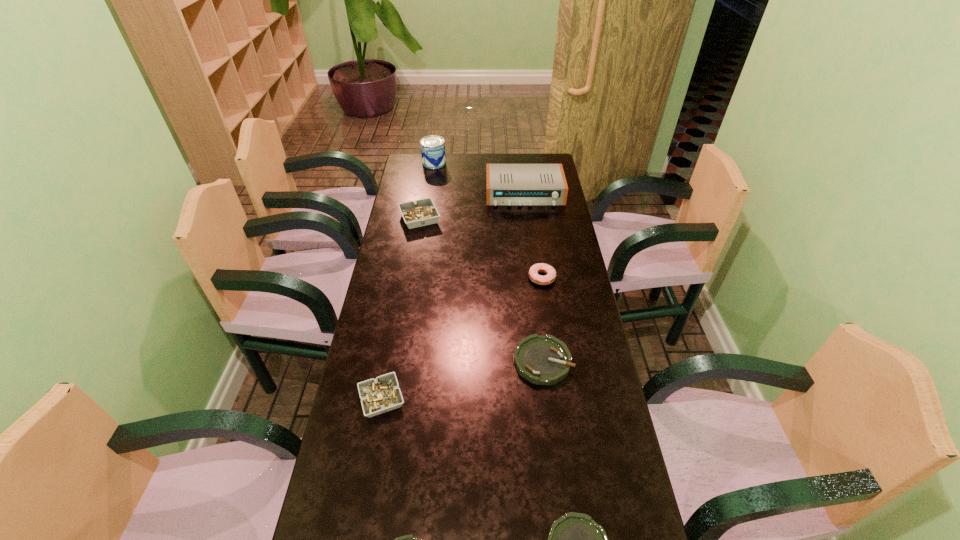
Identify which object is the fourth closest to the tallest ashtray. Please provide its 2D coordinates. Your answer should be formatted as a tuple, i.e. [(x, y)], where the tuple contains the x and y coordinates of a point satisfying the conditions above.

[(542, 360)]

I want to click on object that is the fifth closest one to the fifth nearest object, so click(575, 539).

Find the location of a particular element. The image size is (960, 540). ashtray that is the fourth closest to the bigger gray ashtray is located at coordinates (406, 539).

I want to click on ashtray that stands as the second closest to the tallest object, so coord(542,360).

Point out which green ashtray is positioned as the second nearest to the second smallest green ashtray. Please provide its 2D coordinates. Your answer should be formatted as a tuple, i.e. [(x, y)], where the tuple contains the x and y coordinates of a point satisfying the conditions above.

[(542, 360)]

Identify which green ashtray is the third closest to the bigger gray ashtray. Please provide its 2D coordinates. Your answer should be formatted as a tuple, i.e. [(x, y)], where the tuple contains the x and y coordinates of a point satisfying the conditions above.

[(406, 539)]

This screenshot has height=540, width=960. I want to click on free spot that satisfies the following two spatial constraints: 1. on the front label of the farthest object; 2. on the left side of the farthest green ashtray, so click(405, 361).

Find the location of a particular element. free spot that satisfies the following two spatial constraints: 1. on the control panel of the radio receiver; 2. on the left side of the pink doughnut is located at coordinates (536, 278).

The height and width of the screenshot is (540, 960). Identify the location of vacant space that satisfies the following two spatial constraints: 1. on the control panel of the radio receiver; 2. on the right side of the fifth nearest object. (536, 278).

The image size is (960, 540). I want to click on free space in the image that satisfies the following two spatial constraints: 1. on the control panel of the doughnut; 2. on the left side of the radio receiver, so click(536, 278).